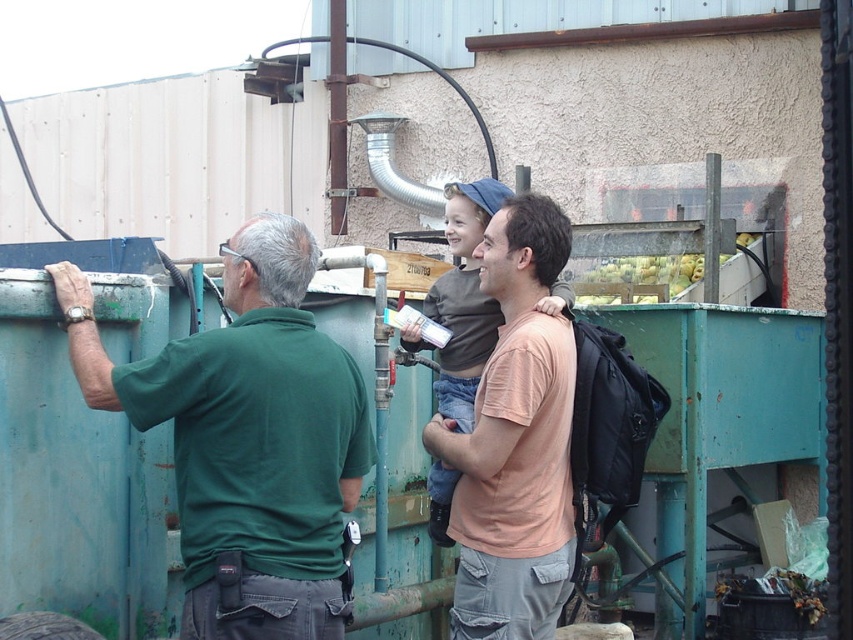
Question: Which point is farther to the camera?

Choices:
 (A) (297, 376)
 (B) (560, 512)

Answer: (B)

Question: Is green matte shirt at left thinner than matte peach t-shirt at center?

Choices:
 (A) yes
 (B) no

Answer: (B)

Question: Considering the relative positions of green matte shirt at left and matte peach t-shirt at center in the image provided, where is green matte shirt at left located with respect to matte peach t-shirt at center?

Choices:
 (A) left
 (B) right

Answer: (A)

Question: Which point is farther to the camera?

Choices:
 (A) (543, 577)
 (B) (184, 458)

Answer: (A)

Question: Can you confirm if green matte shirt at left is positioned below matte peach t-shirt at center?

Choices:
 (A) no
 (B) yes

Answer: (A)